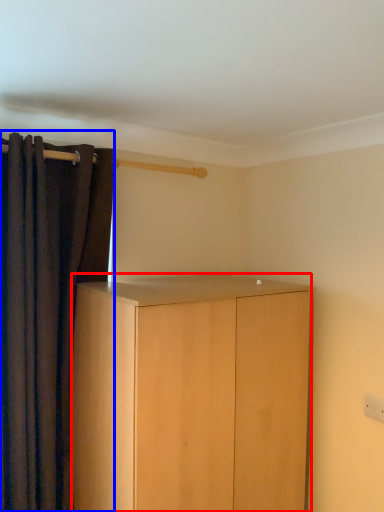
Question: Which object is closer to the camera taking this photo, cabinetry (highlighted by a red box) or curtain (highlighted by a blue box)?

Choices:
 (A) cabinetry
 (B) curtain

Answer: (A)